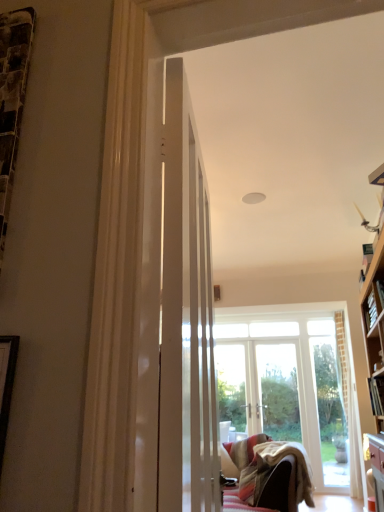
This screenshot has width=384, height=512. Describe the element at coordinates (267, 474) in the screenshot. I see `velvet beige couch at lower center` at that location.

Measure the distance between wooden bookshelf at right, which appears as the second book when viewed from the front, and camera.

wooden bookshelf at right, which appears as the second book when viewed from the front, is 3.12 meters away from camera.

Describe the element at coordinates (376, 395) in the screenshot. I see `hardcover book at right, which ranks as the second book in top-to-bottom order` at that location.

This screenshot has width=384, height=512. Find the location of `white glossy door at center`. white glossy door at center is located at coordinates (186, 316).

Is white glossy door at center positioned far away from velvet beige couch at lower center?

Yes, white glossy door at center and velvet beige couch at lower center are located far from each other.

Can you tell me how much white glossy door at center and velvet beige couch at lower center differ in facing direction?

They differ by 172 degrees in their facing directions.

Between white glossy door at center and velvet beige couch at lower center, which one has smaller size?

white glossy door at center.

From a real-world perspective, which object rests below the other?

velvet beige couch at lower center.

Who is smaller, hardcover book at right, placed as the 1th book when sorted from bottom to top, or white glossy door at center?

hardcover book at right, placed as the 1th book when sorted from bottom to top.

Is hardcover book at right, which ranks as the 2th book in back-to-front order, closer to camera compared to white glossy door at center?

No, hardcover book at right, which ranks as the 2th book in back-to-front order, is further to the viewer.

Is hardcover book at right, which ranks as the 2th book in back-to-front order, far from white glossy door at center?

hardcover book at right, which ranks as the 2th book in back-to-front order, is positioned a significant distance from white glossy door at center.

From the image's perspective, is hardcover book at right, which ranks as the 2th book in back-to-front order, above or below white glossy door at center?

Clearly, from the image's perspective, hardcover book at right, which ranks as the 2th book in back-to-front order, is below white glossy door at center.

From a real-world perspective, is hardcover book at right, which ranks as the second book in top-to-bottom order, beneath velvet beige couch at lower center?

No, from a real-world perspective, hardcover book at right, which ranks as the second book in top-to-bottom order, is not below velvet beige couch at lower center.

Looking at the image, does hardcover book at right, which ranks as the 2th book in back-to-front order, seem bigger or smaller compared to velvet beige couch at lower center?

hardcover book at right, which ranks as the 2th book in back-to-front order, is smaller than velvet beige couch at lower center.

How different are the orientations of hardcover book at right, placed as the 1th book when sorted from bottom to top, and velvet beige couch at lower center in degrees?

The angle between the facing direction of hardcover book at right, placed as the 1th book when sorted from bottom to top, and the facing direction of velvet beige couch at lower center is 0.115 degrees.

Is point (372, 391) closer to camera compared to point (290, 446)?

Yes, it is.

Can velvet beige couch at lower center be found inside wooden bookshelf at right, which appears as the second book when viewed from the front?

That's incorrect, velvet beige couch at lower center is not inside wooden bookshelf at right, which appears as the second book when viewed from the front.

Can you confirm if wooden bookshelf at right, positioned as the 1th book in top-to-bottom order, is positioned to the left of velvet beige couch at lower center?

Incorrect, wooden bookshelf at right, positioned as the 1th book in top-to-bottom order, is not on the left side of velvet beige couch at lower center.

Considering the sizes of objects wooden bookshelf at right, which is the 2th book in bottom-to-top order, and velvet beige couch at lower center in the image provided, who is smaller, wooden bookshelf at right, which is the 2th book in bottom-to-top order, or velvet beige couch at lower center?

wooden bookshelf at right, which is the 2th book in bottom-to-top order.

Between wooden bookshelf at right, which appears as the second book when viewed from the front, and velvet beige couch at lower center, which one has less height?

Standing shorter between the two is wooden bookshelf at right, which appears as the second book when viewed from the front.

Between velvet beige couch at lower center and wooden bookshelf at right, the first book viewed from the back, which one has more height?

Standing taller between the two is velvet beige couch at lower center.

What's the angular difference between velvet beige couch at lower center and wooden bookshelf at right, the first book viewed from the back,'s facing directions?

2.9 degrees separate the facing orientations of velvet beige couch at lower center and wooden bookshelf at right, the first book viewed from the back.

From a real-world perspective, is velvet beige couch at lower center positioned above or below wooden bookshelf at right, which appears as the second book when viewed from the front?

velvet beige couch at lower center is situated lower than wooden bookshelf at right, which appears as the second book when viewed from the front, in the real world.

Find the location of a particular element. The height and width of the screenshot is (512, 384). studio couch lying in front of the wooden bookshelf at right, which is the 2th book in bottom-to-top order is located at coordinates (267, 474).

From the image's perspective, relative to white glossy door at center, is wooden bookshelf at right, the first book viewed from the back, above or below?

Clearly, from the image's perspective, wooden bookshelf at right, the first book viewed from the back, is below white glossy door at center.

Is wooden bookshelf at right, positioned as the 1th book in top-to-bottom order, positioned far away from white glossy door at center?

Yes.

In order to click on the 1st book positioned below the white glossy door at center (from the image's perspective) in this screenshot , I will do `click(370, 310)`.

Based on their sizes in the image, would you say wooden bookshelf at right, which appears as the second book when viewed from the front, is bigger or smaller than white glossy door at center?

Considering their sizes, wooden bookshelf at right, which appears as the second book when viewed from the front, takes up less space than white glossy door at center.

Does hardcover book at right, which ranks as the 2th book in back-to-front order, turn towards wooden bookshelf at right, positioned as the 1th book in top-to-bottom order?

No, hardcover book at right, which ranks as the 2th book in back-to-front order, does not turn towards wooden bookshelf at right, positioned as the 1th book in top-to-bottom order.

From a real-world perspective, which object rests below the other?

In real-world perspective, hardcover book at right, which is counted as the first book, starting from the front, is lower.

Considering the sizes of hardcover book at right, which ranks as the 2th book in back-to-front order, and wooden bookshelf at right, which is the 2th book in bottom-to-top order, in the image, is hardcover book at right, which ranks as the 2th book in back-to-front order, taller or shorter than wooden bookshelf at right, which is the 2th book in bottom-to-top order,?

Clearly, hardcover book at right, which ranks as the 2th book in back-to-front order, is shorter compared to wooden bookshelf at right, which is the 2th book in bottom-to-top order.

Does point (383, 394) come in front of point (370, 306)?

That is True.

Identify the location of door located in front of the velvet beige couch at lower center. (186, 316).

You are a GUI agent. You are given a task and a screenshot of the screen. Output one action in this format:
    pyautogui.click(x=<x>, y=<y>)
    Task: Click on the door lying above the hardcover book at right, placed as the 1th book when sorted from bottom to top (from the image's perspective)
    This screenshot has height=512, width=384.
    Given the screenshot: What is the action you would take?
    (186, 316)

Estimate the real-world distances between objects in this image. Which object is closer to hardcover book at right, which ranks as the 2th book in back-to-front order, white glossy door at center or velvet beige couch at lower center?

Among the two, velvet beige couch at lower center is located nearer to hardcover book at right, which ranks as the 2th book in back-to-front order.

Which object lies nearer to the anchor point white glossy door at center, wooden bookshelf at right, the first book viewed from the back, or hardcover book at right, which ranks as the second book in top-to-bottom order?

wooden bookshelf at right, the first book viewed from the back.

Considering their positions, is velvet beige couch at lower center positioned further to wooden bookshelf at right, positioned as the 1th book in top-to-bottom order, than white glossy door at center?

Based on the image, white glossy door at center appears to be further to wooden bookshelf at right, positioned as the 1th book in top-to-bottom order.

Estimate the real-world distances between objects in this image. Which object is closer to hardcover book at right, which is counted as the first book, starting from the front, velvet beige couch at lower center or wooden bookshelf at right, which appears as the second book when viewed from the front?

wooden bookshelf at right, which appears as the second book when viewed from the front, is closer to hardcover book at right, which is counted as the first book, starting from the front.

When comparing their distances from white glossy door at center, does velvet beige couch at lower center or hardcover book at right, which is counted as the first book, starting from the front, seem closer?

hardcover book at right, which is counted as the first book, starting from the front, lies closer to white glossy door at center than the other object.

Which object lies nearer to the anchor point hardcover book at right, which ranks as the 2th book in back-to-front order, wooden bookshelf at right, positioned as the 1th book in top-to-bottom order, or velvet beige couch at lower center?

wooden bookshelf at right, positioned as the 1th book in top-to-bottom order, is positioned closer to the anchor hardcover book at right, which ranks as the 2th book in back-to-front order.

From the image, which object appears to be nearer to velvet beige couch at lower center, hardcover book at right, placed as the 1th book when sorted from bottom to top, or white glossy door at center?

hardcover book at right, placed as the 1th book when sorted from bottom to top, lies closer to velvet beige couch at lower center than the other object.

Based on their spatial positions, is hardcover book at right, which ranks as the second book in top-to-bottom order, or velvet beige couch at lower center closer to white glossy door at center?

Based on the image, hardcover book at right, which ranks as the second book in top-to-bottom order, appears to be nearer to white glossy door at center.

This screenshot has height=512, width=384. I want to click on studio couch positioned between white glossy door at center and wooden bookshelf at right, which appears as the second book when viewed from the front, from near to far, so click(267, 474).

Where is `book that lies between wooden bookshelf at right, which appears as the second book when viewed from the front, and velvet beige couch at lower center from top to bottom`? This screenshot has height=512, width=384. book that lies between wooden bookshelf at right, which appears as the second book when viewed from the front, and velvet beige couch at lower center from top to bottom is located at coordinates (376, 395).

Where is `book between white glossy door at center and velvet beige couch at lower center from front to back`? Image resolution: width=384 pixels, height=512 pixels. book between white glossy door at center and velvet beige couch at lower center from front to back is located at coordinates (376, 395).

Locate an element on the screen. book located between white glossy door at center and wooden bookshelf at right, which appears as the second book when viewed from the front, in the depth direction is located at coordinates (376, 395).